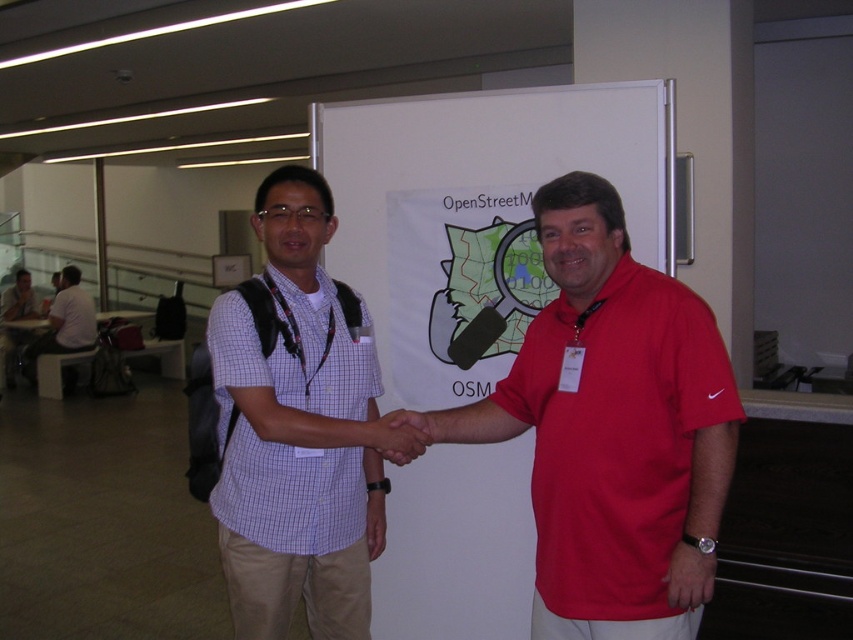
Question: Among these objects, which one is nearest to the camera?

Choices:
 (A) white checkered shirt at center
 (B) white shirt at left
 (C) red cotton polo shirt at center
 (D) matte black hand at center

Answer: (C)

Question: Is red cotton polo shirt at center closer to the viewer compared to white shirt at left?

Choices:
 (A) yes
 (B) no

Answer: (A)

Question: Does red cotton polo shirt at center appear over matte black hand at center?

Choices:
 (A) no
 (B) yes

Answer: (B)

Question: Which of the following is the closest to the observer?

Choices:
 (A) white shirt at left
 (B) white checkered shirt at center
 (C) matte black hand at center

Answer: (B)

Question: Which object is positioned farthest from the white shirt at left?

Choices:
 (A) red cotton polo shirt at center
 (B) matte black hand at center
 (C) white checkered shirt at center

Answer: (A)

Question: Can you confirm if red cotton polo shirt at center is wider than white shirt at left?

Choices:
 (A) no
 (B) yes

Answer: (A)